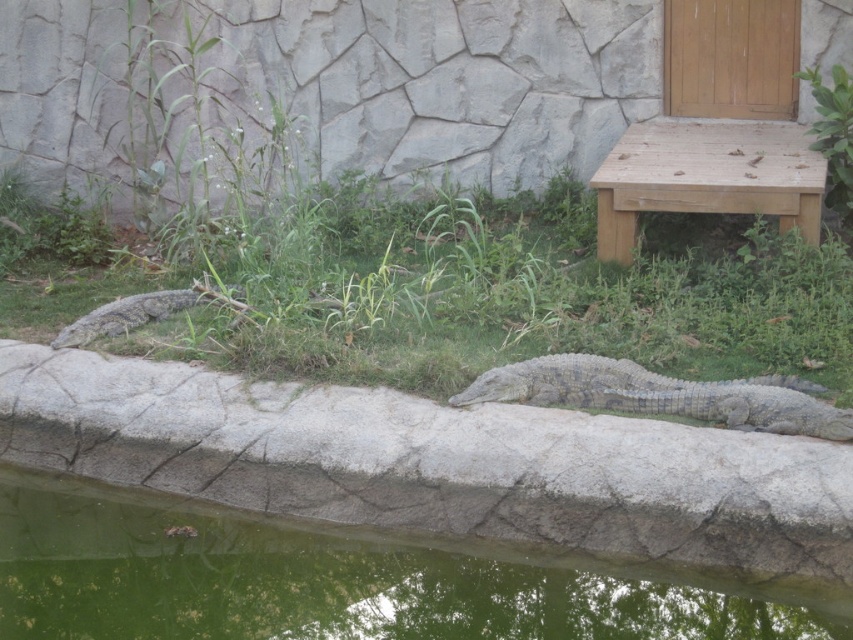
You are standing at the center of the image and want to move towards the wooden bench to the right of the stone wall. Which direction should you go relative to the green grass at center?

The green grass at center is located at point (451, 292). Since you want to move towards the wooden bench to the right of the stone wall, you should head towards the right side of the image relative to the green grass at center.

You are a visitor at the zoo and want to sit on the wooden bench to the right of the stone wall. You see the green grass at center and the gray textured crocodile at center. Which object is closer to you as you approach the bench?

The green grass at center is closer to you than the gray textured crocodile at center as you approach the bench.

From the picture: You are a zookeeper who needs to place a new sign on the wooden bench at upper right. To ensure visitors can see the sign clearly, you want it positioned so that it isn not blocked by the gray concrete wall at center. Based on the scene description, where should you place the sign on the bench?

Since the gray concrete wall at center is to the left of the wooden bench at upper right, you should place the sign on the right side of the wooden bench at upper right to keep it visible and unobstructed by the wall.